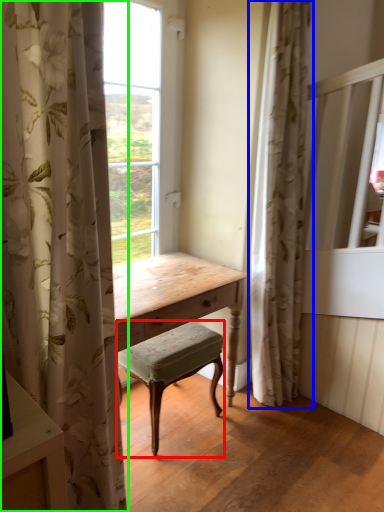
Question: Considering the real-world distances, which object is farthest from stool (highlighted by a red box)? curtain (highlighted by a blue box) or curtain (highlighted by a green box)?

Choices:
 (A) curtain
 (B) curtain

Answer: (B)